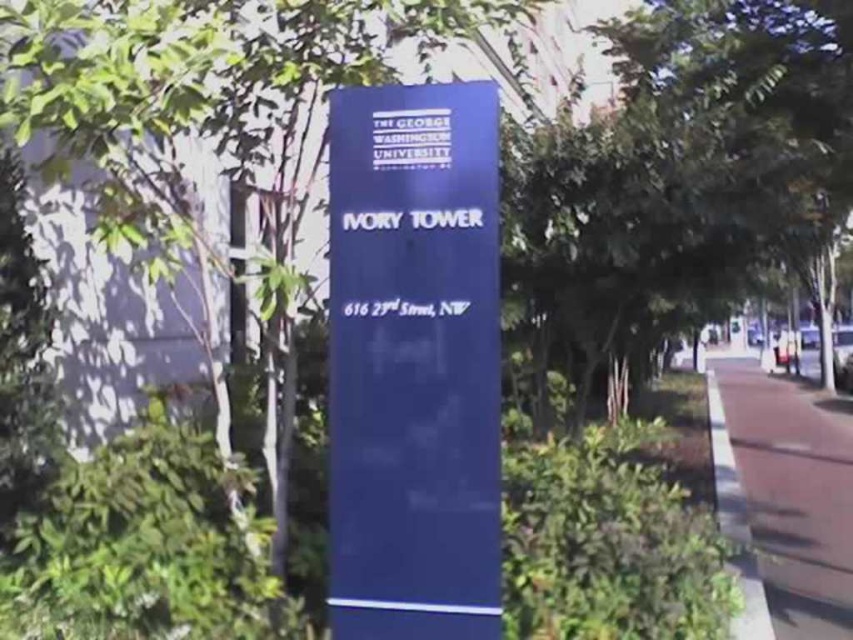
You are a student trying to find the address of The George Washington University. You see the blue glossy sign at center and the white paper at center. Which object should you look at to find the address?

The blue glossy sign at center has a larger size compared to white paper at center, so the address is more likely displayed on the blue glossy sign at center.

You are standing in front of the blue signpost at The George Washington University. There are two points marked on the signpost. One is at coordinate point (409,225) and the other at point (370,308). Which of these two points is nearer to your viewpoint?

Point (409,225) is closer to the camera than point (370,308).

You are a student who just arrived at the university and wants to check the address on the sign. However, you notice that the white plastic sign at center and the white paper at center are both in your line of sight. Which one is covering the other?

The white plastic sign at center is positioned over white paper at center, so the white plastic sign at center is covering the white paper at center.